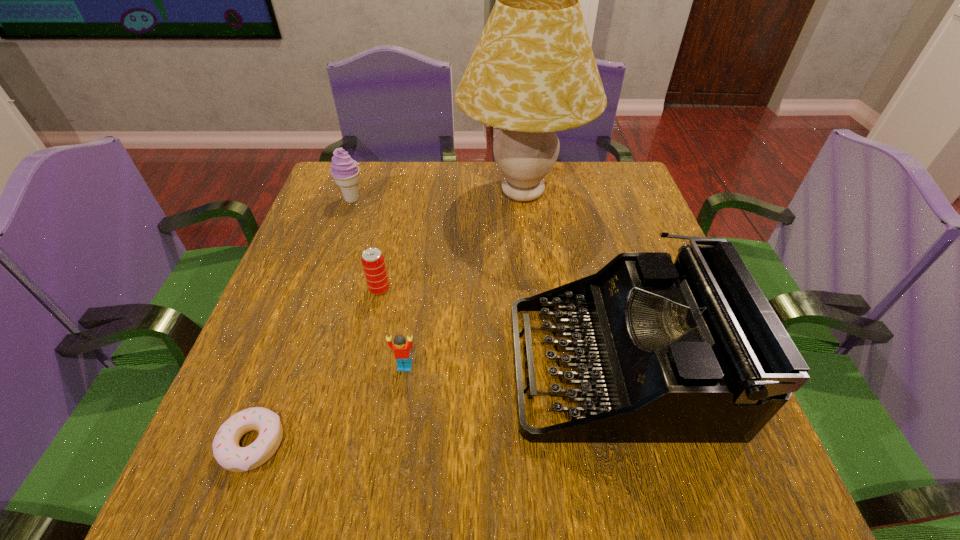
At what (x,y) coordinates should I click in order to perform the action: click on the tallest object. Please return your answer as a coordinate pair (x, y). The image size is (960, 540). Looking at the image, I should click on (533, 72).

Locate an element on the screen. the second tallest object is located at coordinates (687, 352).

At what (x,y) coordinates should I click in order to perform the action: click on the fourth shortest object. Please return your answer as a coordinate pair (x, y). Looking at the image, I should click on (344, 170).

Where is `the fourth object from right to left`? the fourth object from right to left is located at coordinates (373, 263).

You are a GUI agent. You are given a task and a screenshot of the screen. Output one action in this format:
    pyautogui.click(x=<x>, y=<y>)
    Task: Click on the third farthest object
    
    Given the screenshot: What is the action you would take?
    pyautogui.click(x=373, y=263)

You are a GUI agent. You are given a task and a screenshot of the screen. Output one action in this format:
    pyautogui.click(x=<x>, y=<y>)
    Task: Click on the Lego
    
    Given the screenshot: What is the action you would take?
    pyautogui.click(x=401, y=348)

Identify the location of the second shortest object. (401, 348).

At what (x,y) coordinates should I click in order to perform the action: click on the shortest object. Please return your answer as a coordinate pair (x, y). The image size is (960, 540). Looking at the image, I should click on (x=226, y=450).

Identify the location of vacant space located 0.050m on the left of the lampshade. (441, 194).

Where is `vacant area located 0.150m on the typing side of the fifth shortest object`? vacant area located 0.150m on the typing side of the fifth shortest object is located at coordinates (435, 364).